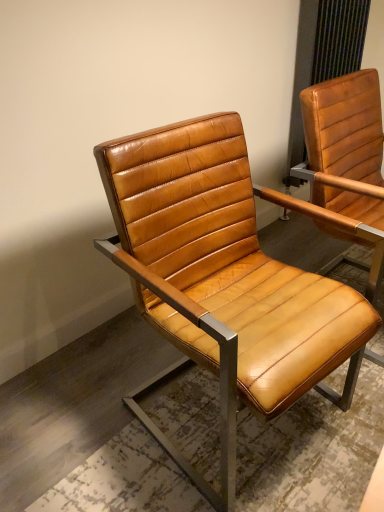
What is the approximate height of cognac leather chair at center, which ranks as the first chair in left-to-right order?

34.27 inches.

I want to click on cognac leather chair at center, positioned as the 2th chair in right-to-left order, so click(x=223, y=279).

What is the approximate width of cognac leather chair at center, positioned as the 2th chair in right-to-left order?

cognac leather chair at center, positioned as the 2th chair in right-to-left order, is 23.94 inches in width.

In order to face cognac leather chair at center, which ranks as the first chair in left-to-right order, should I rotate leftwards or rightwards?

A 6.443 degree turn to the right will do.

Describe the element at coordinates (223, 279) in the screenshot. The image size is (384, 512). I see `cognac leather chair at center, positioned as the 2th chair in right-to-left order` at that location.

What do you see at coordinates (347, 162) in the screenshot? The image size is (384, 512). I see `matte leather chair at right, which is the 1th chair in right-to-left order` at bounding box center [347, 162].

Find the location of a particular element. matte leather chair at right, which is the 1th chair in right-to-left order is located at coordinates (347, 162).

Where is `cognac leather chair at center, positioned as the 2th chair in right-to-left order`? Image resolution: width=384 pixels, height=512 pixels. cognac leather chair at center, positioned as the 2th chair in right-to-left order is located at coordinates (223, 279).

Is cognac leather chair at center, which ranks as the first chair in left-to-right order, to the right of matte leather chair at right, which is the 1th chair in right-to-left order, from the viewer's perspective?

In fact, cognac leather chair at center, which ranks as the first chair in left-to-right order, is to the left of matte leather chair at right, which is the 1th chair in right-to-left order.

Which object is closer to the camera, cognac leather chair at center, which ranks as the first chair in left-to-right order, or matte leather chair at right, placed as the second chair when sorted from left to right?

cognac leather chair at center, which ranks as the first chair in left-to-right order, is closer to the camera.

Is point (208, 314) positioned after point (333, 145)?

No, it is not.

From the image's perspective, does cognac leather chair at center, positioned as the 2th chair in right-to-left order, appear lower than matte leather chair at right, placed as the second chair when sorted from left to right?

Yes.

From a real-world perspective, is cognac leather chair at center, positioned as the 2th chair in right-to-left order, under matte leather chair at right, which is the 1th chair in right-to-left order?

Yes, from a real-world perspective, cognac leather chair at center, positioned as the 2th chair in right-to-left order, is beneath matte leather chair at right, which is the 1th chair in right-to-left order.

Considering the relative sizes of cognac leather chair at center, positioned as the 2th chair in right-to-left order, and matte leather chair at right, placed as the second chair when sorted from left to right, in the image provided, is cognac leather chair at center, positioned as the 2th chair in right-to-left order, wider than matte leather chair at right, placed as the second chair when sorted from left to right,?

Indeed, cognac leather chair at center, positioned as the 2th chair in right-to-left order, has a greater width compared to matte leather chair at right, placed as the second chair when sorted from left to right.

Which of these two, cognac leather chair at center, positioned as the 2th chair in right-to-left order, or matte leather chair at right, which is the 1th chair in right-to-left order, stands shorter?

Standing shorter between the two is cognac leather chair at center, positioned as the 2th chair in right-to-left order.

Who is bigger, cognac leather chair at center, positioned as the 2th chair in right-to-left order, or matte leather chair at right, placed as the second chair when sorted from left to right?

Bigger between the two is cognac leather chair at center, positioned as the 2th chair in right-to-left order.

Looking at this image, is cognac leather chair at center, positioned as the 2th chair in right-to-left order, outside of matte leather chair at right, which is the 1th chair in right-to-left order?

Yes, cognac leather chair at center, positioned as the 2th chair in right-to-left order, is not within matte leather chair at right, which is the 1th chair in right-to-left order.

Is cognac leather chair at center, which ranks as the first chair in left-to-right order, aimed at matte leather chair at right, which is the 1th chair in right-to-left order?

No, cognac leather chair at center, which ranks as the first chair in left-to-right order, is not oriented towards matte leather chair at right, which is the 1th chair in right-to-left order.

Where is `chair that is on the right side of cognac leather chair at center, positioned as the 2th chair in right-to-left order`? chair that is on the right side of cognac leather chair at center, positioned as the 2th chair in right-to-left order is located at coordinates (347, 162).

Based on their positions, is matte leather chair at right, which is the 1th chair in right-to-left order, located to the left or right of cognac leather chair at center, positioned as the 2th chair in right-to-left order?

Based on their positions, matte leather chair at right, which is the 1th chair in right-to-left order, is located to the right of cognac leather chair at center, positioned as the 2th chair in right-to-left order.

In the image, is matte leather chair at right, placed as the second chair when sorted from left to right, positioned in front of or behind cognac leather chair at center, positioned as the 2th chair in right-to-left order?

matte leather chair at right, placed as the second chair when sorted from left to right, is behind cognac leather chair at center, positioned as the 2th chair in right-to-left order.

Is point (363, 134) farther from viewer compared to point (199, 164)?

Yes, it is.

From the image's perspective, which is below, matte leather chair at right, placed as the second chair when sorted from left to right, or cognac leather chair at center, which ranks as the first chair in left-to-right order?

cognac leather chair at center, which ranks as the first chair in left-to-right order, from the image's perspective.

From a real-world perspective, between matte leather chair at right, which is the 1th chair in right-to-left order, and cognac leather chair at center, positioned as the 2th chair in right-to-left order, who is vertically higher?

matte leather chair at right, which is the 1th chair in right-to-left order.

Is matte leather chair at right, which is the 1th chair in right-to-left order, thinner than cognac leather chair at center, positioned as the 2th chair in right-to-left order?

Yes.

In the scene shown: Does matte leather chair at right, which is the 1th chair in right-to-left order, have a lesser height compared to cognac leather chair at center, which ranks as the first chair in left-to-right order?

Incorrect, the height of matte leather chair at right, which is the 1th chair in right-to-left order, does not fall short of that of cognac leather chair at center, which ranks as the first chair in left-to-right order.

Considering the sizes of objects matte leather chair at right, placed as the second chair when sorted from left to right, and cognac leather chair at center, which ranks as the first chair in left-to-right order, in the image provided, who is bigger, matte leather chair at right, placed as the second chair when sorted from left to right, or cognac leather chair at center, which ranks as the first chair in left-to-right order,?

With larger size is cognac leather chair at center, which ranks as the first chair in left-to-right order.

Is matte leather chair at right, which is the 1th chair in right-to-left order, not within cognac leather chair at center, positioned as the 2th chair in right-to-left order?

matte leather chair at right, which is the 1th chair in right-to-left order, is positioned outside cognac leather chair at center, positioned as the 2th chair in right-to-left order.

Does matte leather chair at right, which is the 1th chair in right-to-left order, touch cognac leather chair at center, which ranks as the first chair in left-to-right order?

No, matte leather chair at right, which is the 1th chair in right-to-left order, is not touching cognac leather chair at center, which ranks as the first chair in left-to-right order.

Is matte leather chair at right, which is the 1th chair in right-to-left order, facing towards cognac leather chair at center, positioned as the 2th chair in right-to-left order?

No.

Can you tell me how much matte leather chair at right, which is the 1th chair in right-to-left order, and cognac leather chair at center, which ranks as the first chair in left-to-right order, differ in facing direction?

The angular difference between matte leather chair at right, which is the 1th chair in right-to-left order, and cognac leather chair at center, which ranks as the first chair in left-to-right order, is 4.02 degrees.

In the image, there is a matte leather chair at right, placed as the second chair when sorted from left to right. Where is `chair below it (from the image's perspective)`? chair below it (from the image's perspective) is located at coordinates (223, 279).

Locate an element on the screen. chair above the cognac leather chair at center, positioned as the 2th chair in right-to-left order (from a real-world perspective) is located at coordinates (347, 162).

Identify the location of chair lying on the right of cognac leather chair at center, positioned as the 2th chair in right-to-left order. (347, 162).